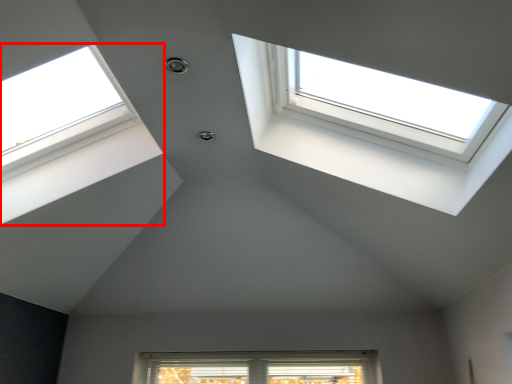
Question: Considering the relative positions of window (annotated by the red box) and window in the image provided, where is window (annotated by the red box) located with respect to the staircase?

Choices:
 (A) left
 (B) right

Answer: (A)